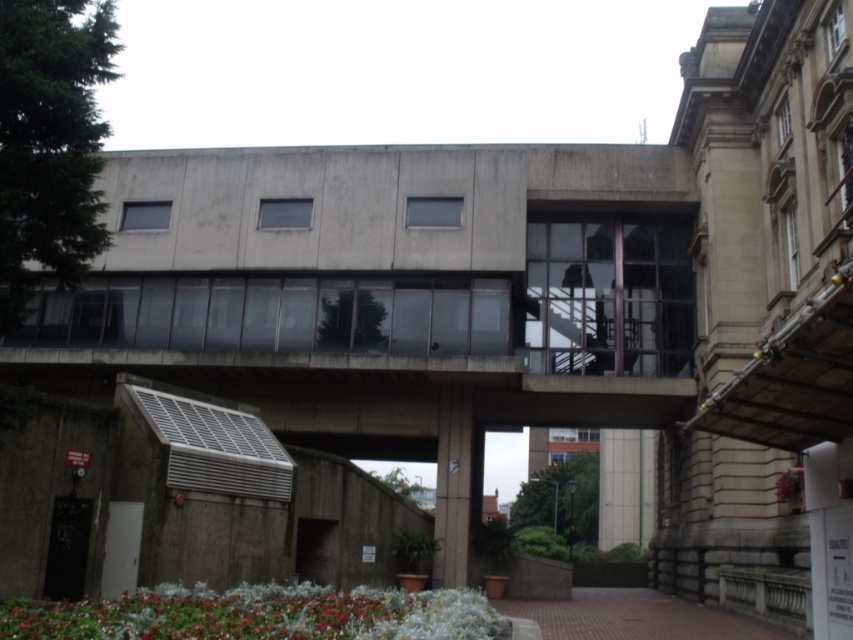
Is green leafy plant at lower center wider than brown brick path at lower center?

In fact, green leafy plant at lower center might be narrower than brown brick path at lower center.

Is point (36, 605) behind point (708, 628)?

No, (36, 605) is in front of (708, 628).

Does point (268, 586) come in front of point (733, 620)?

Yes, it is.

The image size is (853, 640). I want to click on green leafy plant at lower center, so click(x=259, y=614).

Can you confirm if concrete at center is positioned below brown brick path at lower center?

No.

Looking at this image, is concrete at center to the left of brown brick path at lower center from the viewer's perspective?

Correct, you'll find concrete at center to the left of brown brick path at lower center.

The width and height of the screenshot is (853, 640). What do you see at coordinates (386, 296) in the screenshot?
I see `concrete at center` at bounding box center [386, 296].

Locate an element on the screen. The height and width of the screenshot is (640, 853). concrete at center is located at coordinates (386, 296).

Who is taller, concrete at center or green leafy plant at lower center?

With more height is concrete at center.

Does point (115, 328) come behind point (199, 636)?

Yes.

Where is `concrete at center`? This screenshot has height=640, width=853. concrete at center is located at coordinates (386, 296).